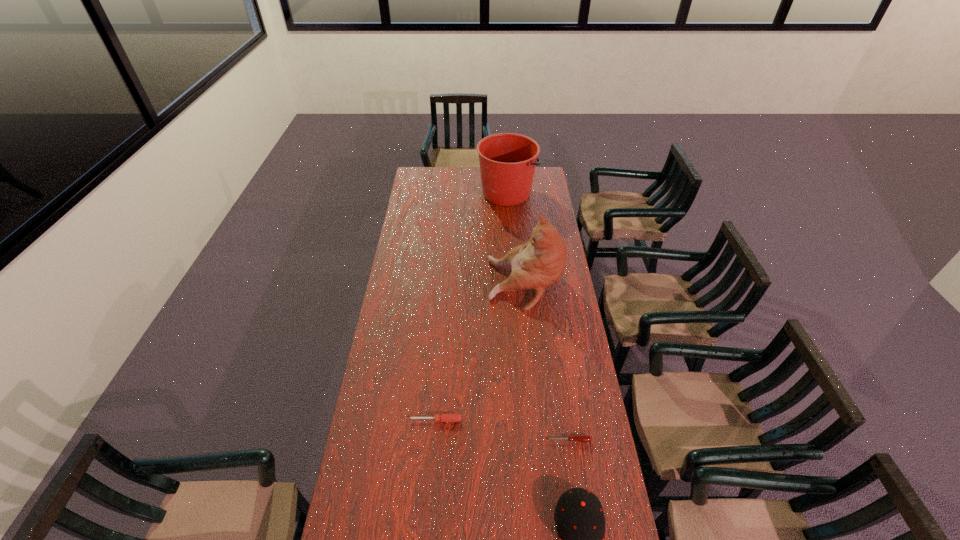
The height and width of the screenshot is (540, 960). Identify the location of free space located on the front of the left screwdriver. (430, 497).

This screenshot has width=960, height=540. In order to click on vacant space located 0.370m on the back of the nearer screwdriver in this screenshot , I will do `click(555, 353)`.

In order to click on object present at the far edge in this screenshot , I will do `click(507, 161)`.

This screenshot has width=960, height=540. I want to click on cat that is positioned at the right edge, so click(x=539, y=263).

Where is `bucket that is at the right edge`? The width and height of the screenshot is (960, 540). bucket that is at the right edge is located at coordinates (507, 161).

Where is `screwdriver that is at the right edge`? Image resolution: width=960 pixels, height=540 pixels. screwdriver that is at the right edge is located at coordinates (581, 438).

Locate an element on the screen. The height and width of the screenshot is (540, 960). object that is at the far right corner is located at coordinates (507, 161).

Where is `free location at the left edge`? This screenshot has height=540, width=960. free location at the left edge is located at coordinates (381, 434).

Where is `free space at the right edge`? free space at the right edge is located at coordinates (531, 194).

Identify the location of blank region between the bucket and the third nearest object. The image size is (960, 540). (471, 306).